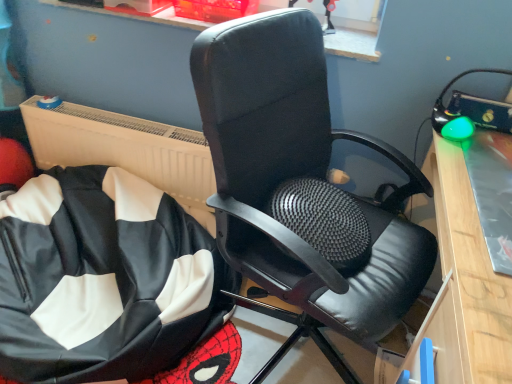
Question: In terms of size, does black leather bean bag at lower left appear bigger or smaller than black leather chair at center?

Choices:
 (A) small
 (B) big

Answer: (A)

Question: Choose the correct answer: Is black leather bean bag at lower left inside black leather chair at center or outside it?

Choices:
 (A) inside
 (B) outside

Answer: (B)

Question: Is black leather bean bag at lower left in front of or behind black leather chair at center in the image?

Choices:
 (A) front
 (B) behind

Answer: (B)

Question: From a real-world perspective, is black leather chair at center above or below black leather bean bag at lower left?

Choices:
 (A) above
 (B) below

Answer: (A)

Question: Which is correct: black leather chair at center is inside black leather bean bag at lower left, or outside of it?

Choices:
 (A) inside
 (B) outside

Answer: (B)

Question: Based on their sizes in the image, would you say black leather chair at center is bigger or smaller than black leather bean bag at lower left?

Choices:
 (A) big
 (B) small

Answer: (A)

Question: Considering their positions, is black leather chair at center located in front of or behind black leather bean bag at lower left?

Choices:
 (A) behind
 (B) front

Answer: (B)